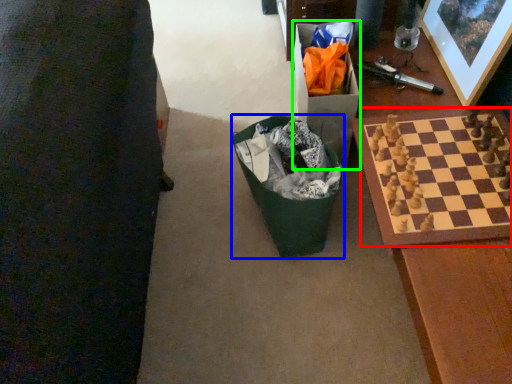
Question: Which object is the farthest from board game (highlighted by a red box)? Choose among these: recycling bin (highlighted by a blue box) or cardboard box (highlighted by a green box).

Choices:
 (A) recycling bin
 (B) cardboard box

Answer: (A)